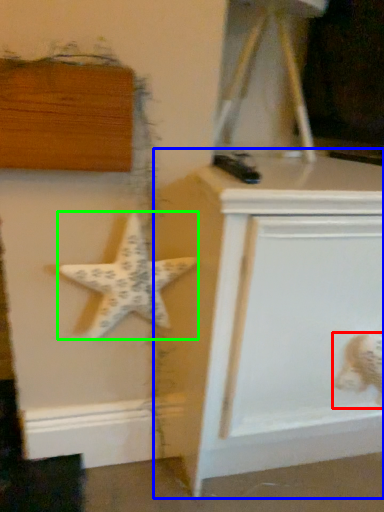
Question: Estimate the real-world distances between objects in this image. Which object is farther from toy (highlighted by a red box), vanity (highlighted by a blue box) or starfish (highlighted by a green box)?

Choices:
 (A) vanity
 (B) starfish

Answer: (B)